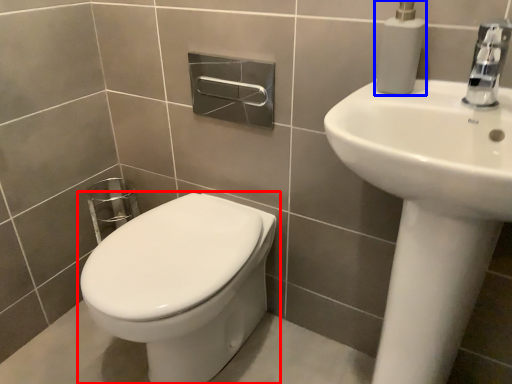
Question: Which object is further to the camera taking this photo, toilet (highlighted by a red box) or soap dispenser (highlighted by a blue box)?

Choices:
 (A) toilet
 (B) soap dispenser

Answer: (A)